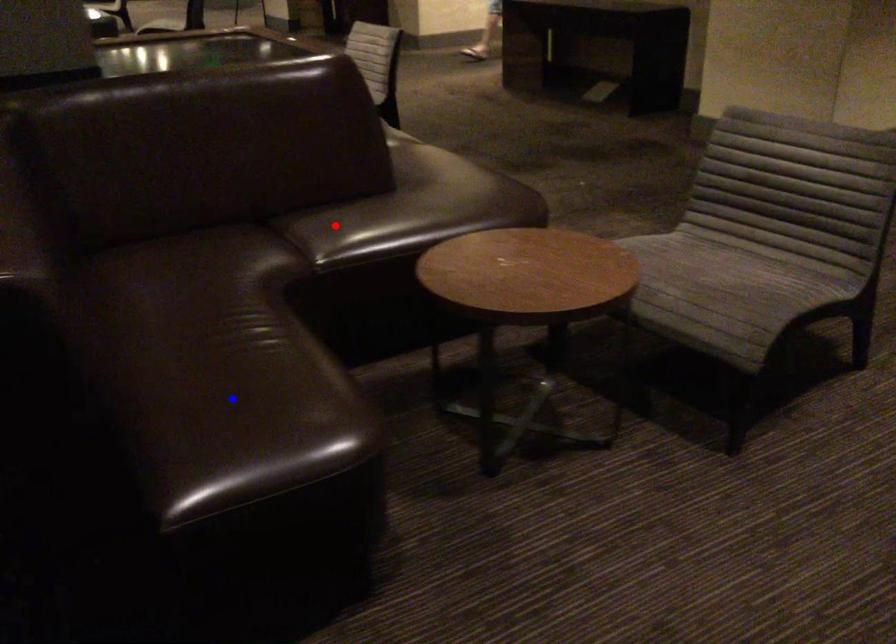
Question: Two points are marked on the image. Which point is closer to the camera?

Choices:
 (A) Blue point is closer.
 (B) Red point is closer.

Answer: (A)